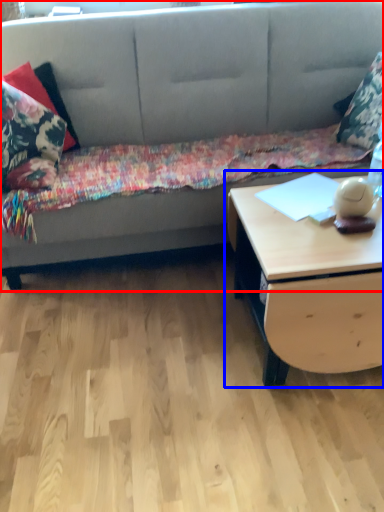
Question: Which object appears farthest to the camera in this image, studio couch (highlighted by a red box) or table (highlighted by a blue box)?

Choices:
 (A) studio couch
 (B) table

Answer: (A)